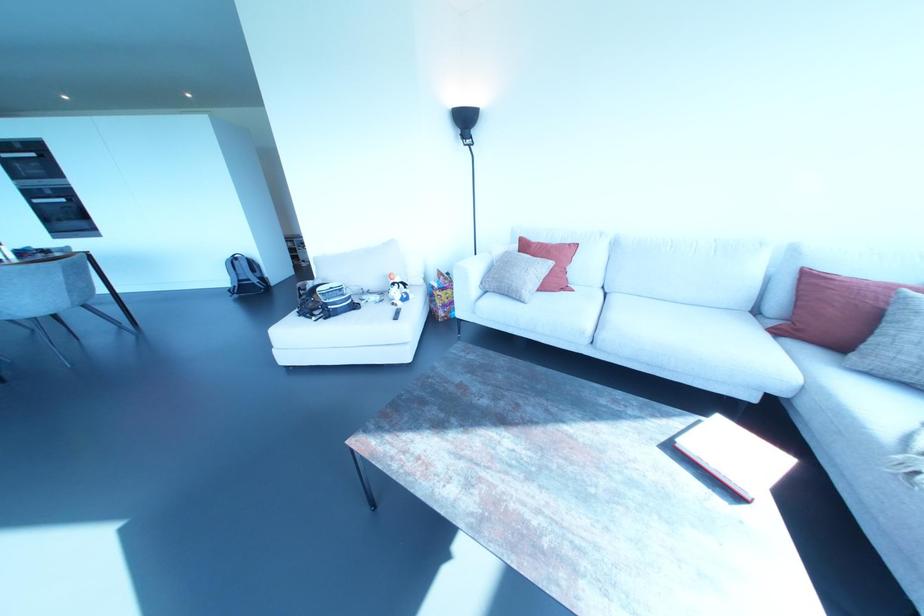
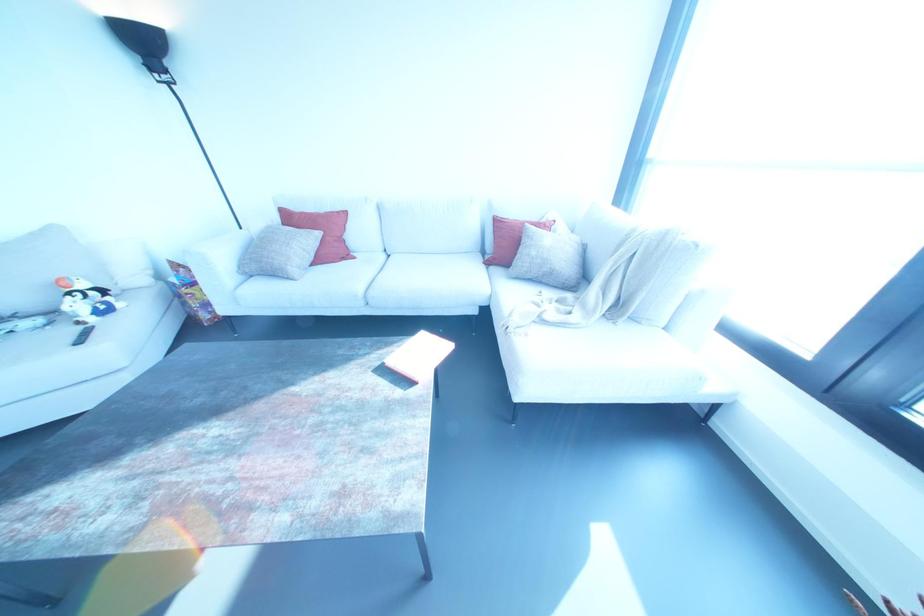
In the second image, find the point that corresponds to (x=737, y=452) in the first image.

(423, 352)